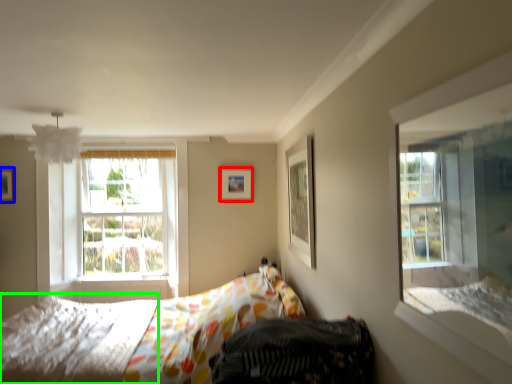
Question: Which is farther away from picture frame (highlighted by a red box)? picture frame (highlighted by a blue box) or mattress (highlighted by a green box)?

Choices:
 (A) picture frame
 (B) mattress

Answer: (A)